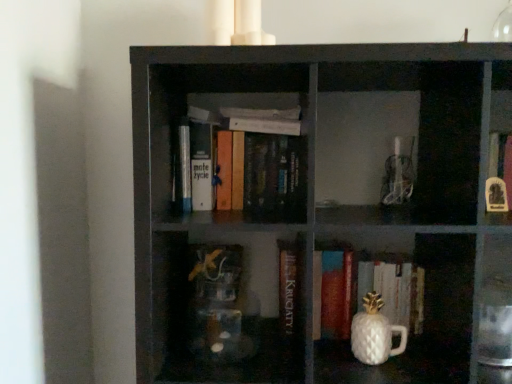
Where is `white knitted tea pot at lower right`? white knitted tea pot at lower right is located at coordinates (375, 333).

This screenshot has height=384, width=512. What do you see at coordinates (503, 25) in the screenshot?
I see `transparent glass vase at upper right` at bounding box center [503, 25].

Measure the distance between point [506,21] and camera.

Point [506,21] and camera are 3.97 feet apart.

What do you see at coordinates (289, 289) in the screenshot? Image resolution: width=512 pixels, height=384 pixels. I see `hardcover book at center, placed as the second book when sorted from right to left` at bounding box center [289, 289].

What do you see at coordinates (254, 160) in the screenshot? Image resolution: width=512 pixels, height=384 pixels. I see `hardcover books at center, which appears as the 1th book when viewed from the left` at bounding box center [254, 160].

In order to click on white knitted tea pot at lower right in this screenshot , I will do `click(375, 333)`.

Does black matte bookshelf at center appear on the left side of hardcover book at center, the 2th book when ordered from left to right?

No.

Who is taller, black matte bookshelf at center or hardcover book at center, placed as the second book when sorted from right to left?

With more height is black matte bookshelf at center.

Which object is wider, black matte bookshelf at center or hardcover book at center, placed as the second book when sorted from right to left?

black matte bookshelf at center.

Are black matte bookshelf at center and hardcover book at center, the 2th book when ordered from left to right, making contact?

No, black matte bookshelf at center is not in contact with hardcover book at center, the 2th book when ordered from left to right.

Is hardcover book at center, the 2th book when ordered from left to right, positioned far away from hardcover books at center, which appears as the 1th book when viewed from the left?

No, hardcover book at center, the 2th book when ordered from left to right, is not far away from hardcover books at center, which appears as the 1th book when viewed from the left.

From the image's perspective, is hardcover book at center, the 2th book when ordered from left to right, beneath hardcover books at center, the third book viewed from the right?

Yes, from the image's perspective, hardcover book at center, the 2th book when ordered from left to right, is below hardcover books at center, the third book viewed from the right.

How different are the orientations of hardcover book at center, the 2th book when ordered from left to right, and hardcover books at center, which appears as the 1th book when viewed from the left, in degrees?

The facing directions of hardcover book at center, the 2th book when ordered from left to right, and hardcover books at center, which appears as the 1th book when viewed from the left, are 0.000657 degrees apart.

Is hardcover book at center, the 2th book when ordered from left to right, oriented away from hardcover books at center, the third book viewed from the right?

hardcover book at center, the 2th book when ordered from left to right, is not turned away from hardcover books at center, the third book viewed from the right.

From their relative heights in the image, would you say white knitted tea pot at lower right is taller or shorter than transparent glass vase at upper right?

white knitted tea pot at lower right is shorter than transparent glass vase at upper right.

Is white knitted tea pot at lower right situated inside transparent glass vase at upper right or outside?

white knitted tea pot at lower right is not inside transparent glass vase at upper right, it's outside.

Are white knitted tea pot at lower right and transparent glass vase at upper right beside each other?

No, white knitted tea pot at lower right is not with transparent glass vase at upper right.

Which object is more forward, white knitted tea pot at lower right or transparent glass vase at upper right?

Positioned in front is transparent glass vase at upper right.

Is white knitted tea pot at lower right outside of white glossy pineapple-shaped object at lower center, acting as the 3th book starting from the left?

white knitted tea pot at lower right lies outside white glossy pineapple-shaped object at lower center, acting as the 3th book starting from the left,'s area.

Is white knitted tea pot at lower right to the left of white glossy pineapple-shaped object at lower center, acting as the 3th book starting from the left, from the viewer's perspective?

Correct, you'll find white knitted tea pot at lower right to the left of white glossy pineapple-shaped object at lower center, acting as the 3th book starting from the left.

Is there a large distance between white knitted tea pot at lower right and white glossy pineapple-shaped object at lower center, acting as the 3th book starting from the left?

No, there isn't a large distance between white knitted tea pot at lower right and white glossy pineapple-shaped object at lower center, acting as the 3th book starting from the left.

Is point (362, 300) positioned after point (408, 285)?

No, it is in front of (408, 285).

Considering the sizes of objects white glossy pineapple-shaped object at lower center, acting as the 3th book starting from the left, and white knitted tea pot at lower right in the image provided, who is wider, white glossy pineapple-shaped object at lower center, acting as the 3th book starting from the left, or white knitted tea pot at lower right?

With larger width is white glossy pineapple-shaped object at lower center, acting as the 3th book starting from the left.

Is white glossy pineapple-shaped object at lower center, acting as the 3th book starting from the left, turned away from white knitted tea pot at lower right?

No, white glossy pineapple-shaped object at lower center, acting as the 3th book starting from the left, is not facing away from white knitted tea pot at lower right.

From the image's perspective, is white glossy pineapple-shaped object at lower center, the 1th book viewed from the right, located above white knitted tea pot at lower right?

Yes, from the image's perspective, white glossy pineapple-shaped object at lower center, the 1th book viewed from the right, is over white knitted tea pot at lower right.

In terms of height, does hardcover books at center, which appears as the 1th book when viewed from the left, look taller or shorter compared to transparent glass vase at upper right?

Result: In the image, hardcover books at center, which appears as the 1th book when viewed from the left, appears to be taller than transparent glass vase at upper right.

Who is more distant, hardcover books at center, which appears as the 1th book when viewed from the left, or transparent glass vase at upper right?

hardcover books at center, which appears as the 1th book when viewed from the left, is further away from the camera.

Can you tell me how much hardcover books at center, the third book viewed from the right, and transparent glass vase at upper right differ in facing direction?

6.09 degrees separate the facing orientations of hardcover books at center, the third book viewed from the right, and transparent glass vase at upper right.

Is hardcover books at center, which appears as the 1th book when viewed from the left, behind white knitted tea pot at lower right?

Yes.

Do you think hardcover books at center, which appears as the 1th book when viewed from the left, is within white knitted tea pot at lower right, or outside of it?

hardcover books at center, which appears as the 1th book when viewed from the left, is not enclosed by white knitted tea pot at lower right.

The image size is (512, 384). Find the location of `the 1st book positioned below the black matte bookshelf at center (from the image's perspective)`. the 1st book positioned below the black matte bookshelf at center (from the image's perspective) is located at coordinates (289, 289).

Find the location of a particular element. This screenshot has width=512, height=384. book above the hardcover book at center, the 2th book when ordered from left to right (from a real-world perspective) is located at coordinates (254, 160).

Based on their spatial positions, is white glossy pineapple-shaped object at lower center, the 1th book viewed from the right, or hardcover book at center, the 2th book when ordered from left to right, closer to white knitted tea pot at lower right?

white glossy pineapple-shaped object at lower center, the 1th book viewed from the right, is positioned closer to the anchor white knitted tea pot at lower right.

When comparing their distances from black matte bookshelf at center, does white glossy pineapple-shaped object at lower center, acting as the 3th book starting from the left, or transparent glass vase at upper right seem closer?

Based on the image, white glossy pineapple-shaped object at lower center, acting as the 3th book starting from the left, appears to be nearer to black matte bookshelf at center.

When comparing their distances from black matte bookshelf at center, does white knitted tea pot at lower right or white glossy pineapple-shaped object at lower center, the 1th book viewed from the right, seem further?

Based on the image, white knitted tea pot at lower right appears to be further to black matte bookshelf at center.

When comparing their distances from hardcover book at center, the 2th book when ordered from left to right, does white knitted tea pot at lower right or transparent glass vase at upper right seem further?

transparent glass vase at upper right.

Considering their positions, is transparent glass vase at upper right positioned closer to hardcover books at center, the third book viewed from the right, than black matte bookshelf at center?

black matte bookshelf at center is closer to hardcover books at center, the third book viewed from the right.

Considering their positions, is hardcover books at center, which appears as the 1th book when viewed from the left, positioned closer to transparent glass vase at upper right than white glossy pineapple-shaped object at lower center, the 1th book viewed from the right?

white glossy pineapple-shaped object at lower center, the 1th book viewed from the right, is closer to transparent glass vase at upper right.

Looking at the image, which one is located closer to black matte bookshelf at center, transparent glass vase at upper right or hardcover books at center, the third book viewed from the right?

hardcover books at center, the third book viewed from the right, lies closer to black matte bookshelf at center than the other object.

Looking at the image, which one is located closer to hardcover books at center, the third book viewed from the right, hardcover book at center, placed as the second book when sorted from right to left, or transparent glass vase at upper right?

hardcover book at center, placed as the second book when sorted from right to left, is positioned closer to the anchor hardcover books at center, the third book viewed from the right.

This screenshot has width=512, height=384. What are the coordinates of `book situated between hardcover books at center, which appears as the 1th book when viewed from the left, and white glossy pineapple-shaped object at lower center, the 1th book viewed from the right, from left to right` in the screenshot? It's located at (289, 289).

Identify the location of shelf between hardcover books at center, which appears as the 1th book when viewed from the left, and white knitted tea pot at lower right from top to bottom. This screenshot has width=512, height=384. (321, 208).

Locate an element on the screen. book located between black matte bookshelf at center and hardcover book at center, placed as the second book when sorted from right to left, in the depth direction is located at coordinates (254, 160).

Where is `shelf between transparent glass vase at upper right and hardcover book at center, the 2th book when ordered from left to right, from top to bottom`? Image resolution: width=512 pixels, height=384 pixels. shelf between transparent glass vase at upper right and hardcover book at center, the 2th book when ordered from left to right, from top to bottom is located at coordinates (321, 208).